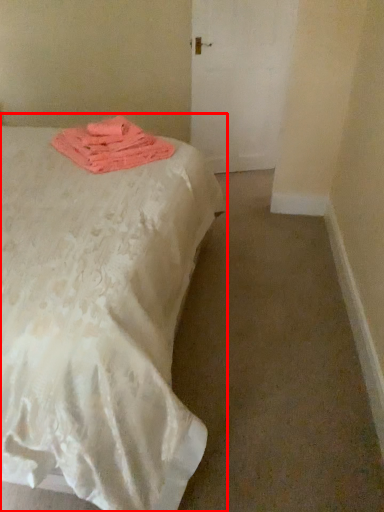
Question: From the image's perspective, where is bed (annotated by the red box) located relative to cloth?

Choices:
 (A) above
 (B) below

Answer: (B)